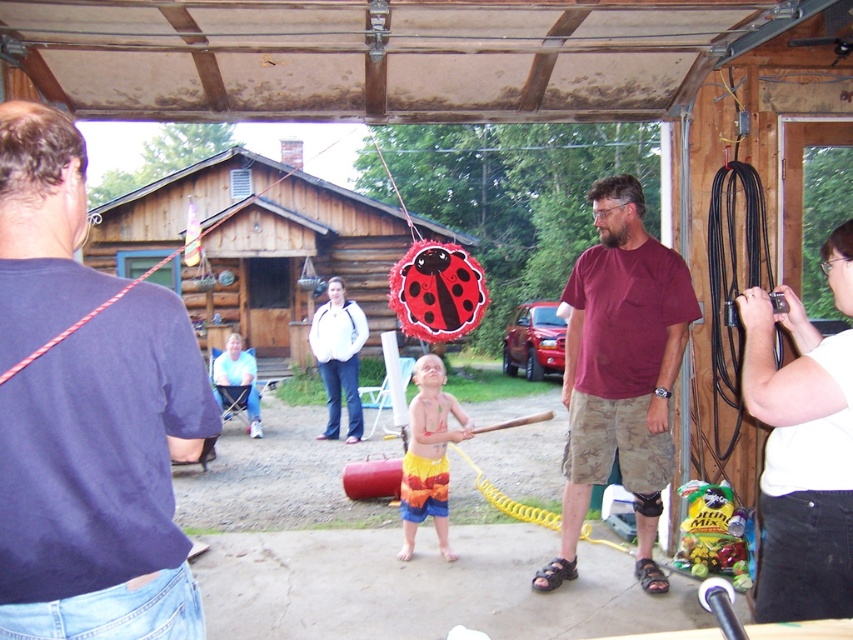
Question: Does dark blue t-shirt at upper left have a greater width compared to maroon cotton shirt at center?

Choices:
 (A) no
 (B) yes

Answer: (A)

Question: Is dark blue t-shirt at upper left in front of rainbow swim trunks at center?

Choices:
 (A) yes
 (B) no

Answer: (A)

Question: Which object appears closest to the camera in this image?

Choices:
 (A) maroon cotton shirt at center
 (B) rainbow swim trunks at center

Answer: (A)

Question: Considering the real-world distances, which object is closest to the maroon cotton shirt at center?

Choices:
 (A) rainbow swim trunks at center
 (B) dark blue t-shirt at upper left

Answer: (A)

Question: Which point is farther to the camera?

Choices:
 (A) [x=22, y=266]
 (B) [x=418, y=408]

Answer: (B)

Question: Is dark blue t-shirt at upper left thinner than rainbow swim trunks at center?

Choices:
 (A) no
 (B) yes

Answer: (B)